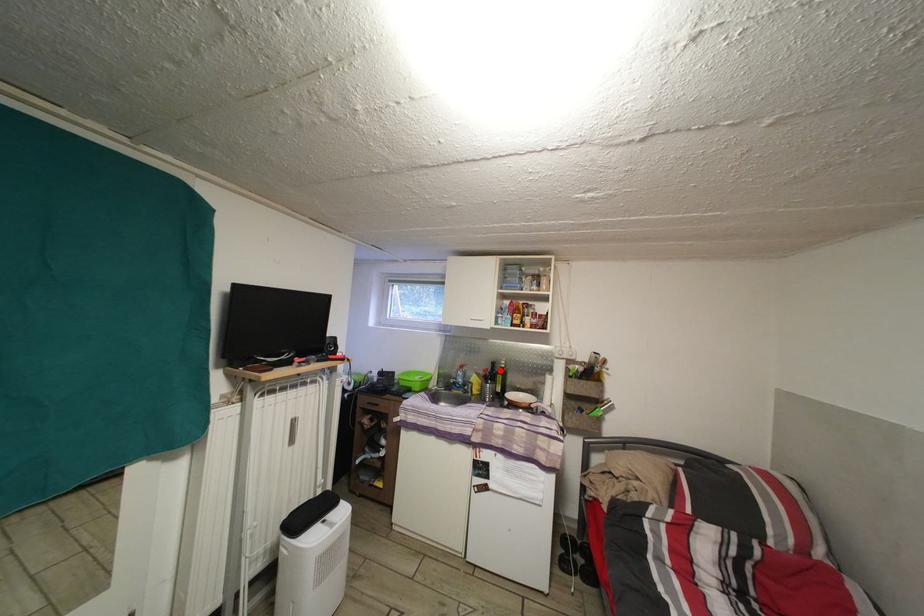
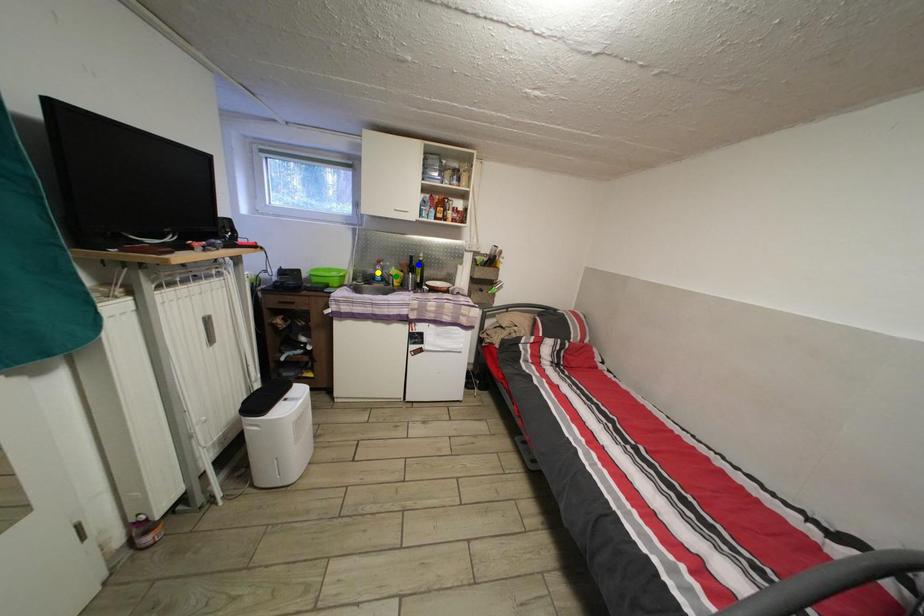
Question: I am providing you with two images of the same scene from different viewpoints. A red point is marked on the first image. You are given multiple points on the second image. Which mark in image 2 goes with the point in image 1?

Choices:
 (A) yellow point
 (B) green point
 (C) blue point

Answer: (C)